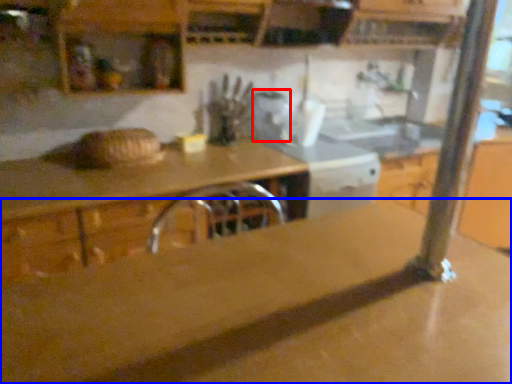
Question: Which point is further to the camera, appliance (highlighted by a red box) or countertop (highlighted by a blue box)?

Choices:
 (A) appliance
 (B) countertop

Answer: (A)